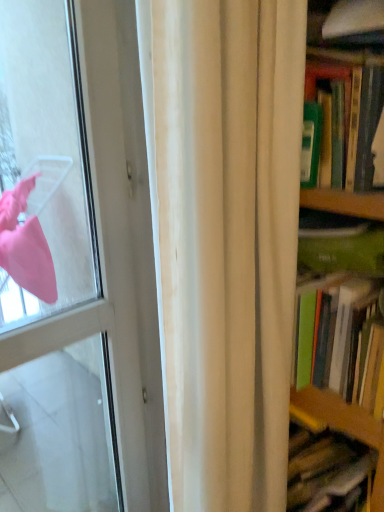
Question: Looking at their shapes, would you say white glossy door at left is wider or thinner than white fabric curtain at center?

Choices:
 (A) thin
 (B) wide

Answer: (A)

Question: Looking at the image, does white glossy door at left seem bigger or smaller compared to white fabric curtain at center?

Choices:
 (A) small
 (B) big

Answer: (A)

Question: Considering the real-world distances, which object is farthest from the white glossy door at left?

Choices:
 (A) green matte book at right
 (B) white fabric curtain at center

Answer: (A)

Question: Considering the real-world distances, which object is farthest from the green matte book at right?

Choices:
 (A) white glossy door at left
 (B) white fabric curtain at center

Answer: (A)